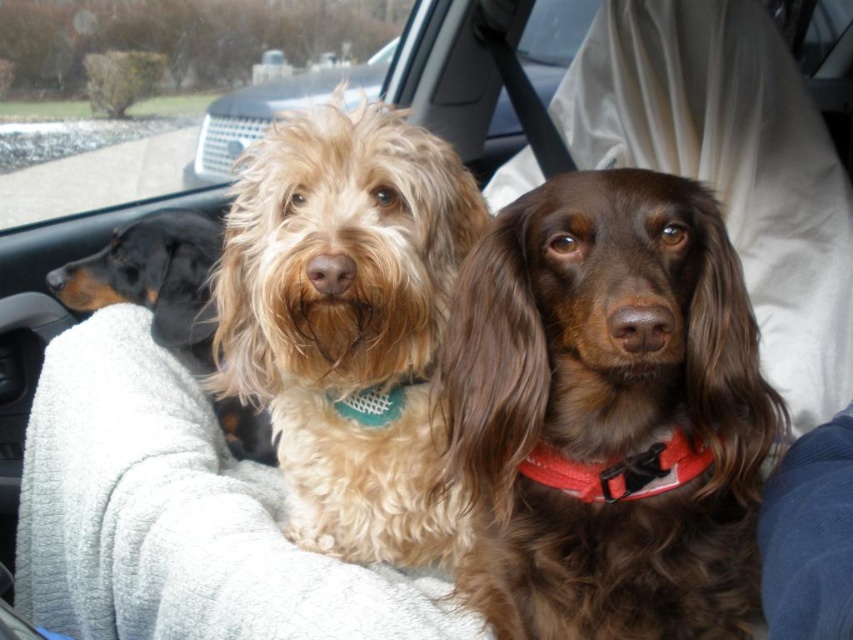
Question: Can you confirm if fuzzy beige dog at center is thinner than transparent glass window at upper center?

Choices:
 (A) no
 (B) yes

Answer: (B)

Question: Which object is positioned closest to the fuzzy beige dog at center?

Choices:
 (A) brown shaggy dog at center
 (B) black smooth dachshund at left

Answer: (A)

Question: Is transparent glass window at upper center bigger than black smooth dachshund at left?

Choices:
 (A) yes
 (B) no

Answer: (A)

Question: Among these objects, which one is farthest from the camera?

Choices:
 (A) fuzzy beige dog at center
 (B) brown shaggy dog at center

Answer: (A)

Question: Is fuzzy beige dog at center to the right of transparent glass window at upper center from the viewer's perspective?

Choices:
 (A) yes
 (B) no

Answer: (A)

Question: Which object is the farthest from the fuzzy beige dog at center?

Choices:
 (A) brown shaggy dog at center
 (B) black smooth dachshund at left

Answer: (B)